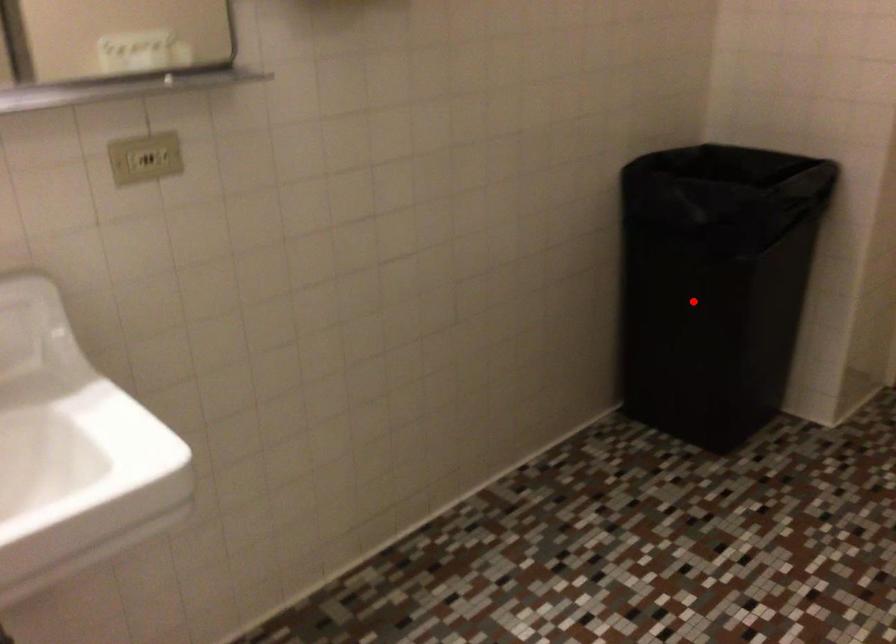
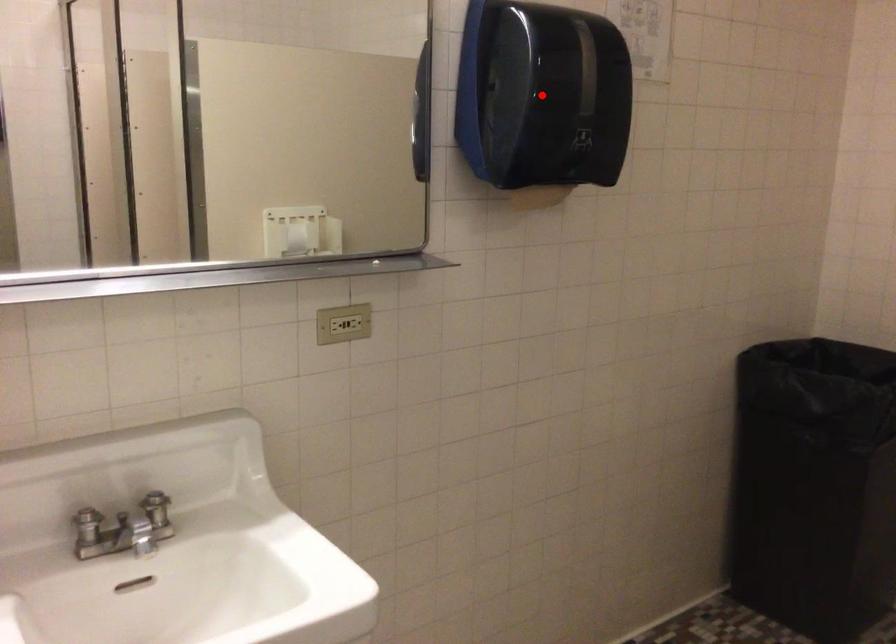
In the scene shown: I am providing you with two images of the same scene from different viewpoints. A red point is marked on the first image and another point is marked on the second image. Is the marked point in image1 the same physical position as the marked point in image2?

No